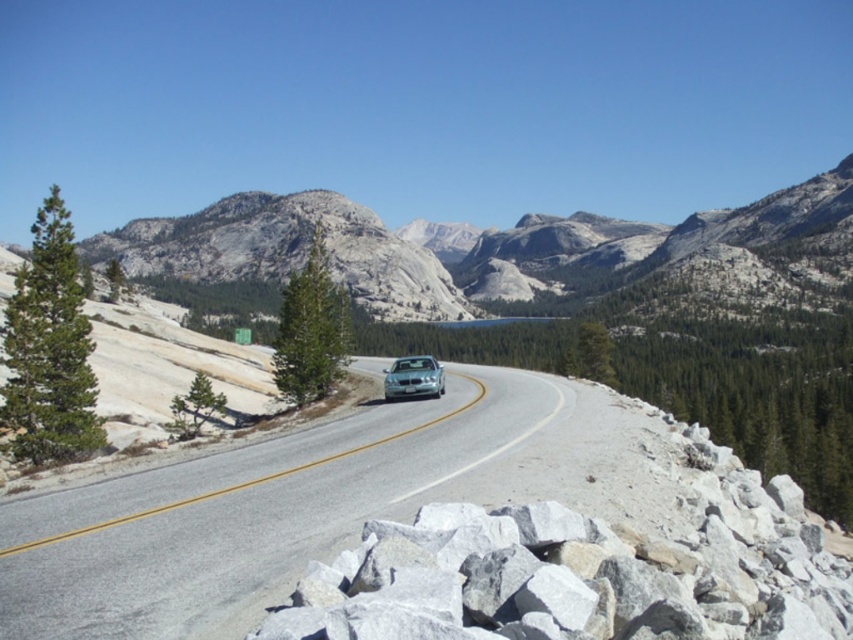
You are a drone operator trying to capture aerial footage of the mountain road. You have two points marked on your map, point A at coordinates point [404,604] and point B at coordinates point [430,394]. Which point should you prioritize filming first if you want to start from the closest to your current position?

Point point [404,604] is closer to the camera than point point [430,394], so you should prioritize filming point point [404,604] first since it is closer to your current position.

You are driving a car and want to know if you can safely pass under a bridge ahead. The bridge has a height restriction sign indicating a maximum clearance of 2 meters. You see a gray rock at center and a sleek silver sedan at center in your path. Which object can you use to estimate the clearance height of the bridge?

The gray rock at center has a greater height compared to the sleek silver sedan at center. Since the sleek silver sedan at center is shorter than the gray rock at center, if the sedan can pass under the bridge, the clearance is at least taller than the sedan but might not accommodate the gray rock. However, since the maximum clearance is 2 meters, if the sedan is under 2 meters, it can pass, but the rock would be too tall. But without knowing the exact height of the sedan or rock, the best estimation would

You are a driver approaching the mountain road and see the gray rock at center and the sleek silver sedan at center ahead. Which object is closer to you as you drive forward?

The gray rock at center is closer to you because it is positioned below the sleek silver sedan at center, indicating it is in a lower spatial plane along the road.